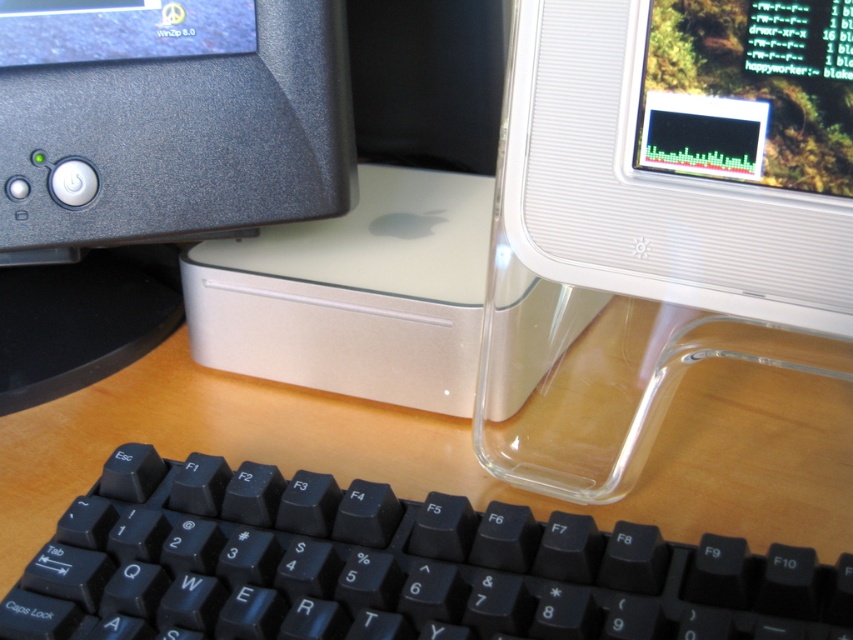
From the picture: You are setting up a new computer desk. You have a black plastic keyboard at lower center and a white Apple desktop computer tower behind it. You want to place a 12 inch long cable between them. Will the cable be long enough to reach?

The distance between the black plastic keyboard at lower center and the white Apple desktop computer tower is 12.28 inches. Since the cable is 12 inches long, it is slightly shorter than the required distance. The cable may not be long enough to comfortably reach between them.

You are setting up a new computer desk and need to ensure there is enough space between the black plastic keyboard at lower center and the transparent plastic screen at upper right. According to the image, what is the minimum distance you should leave between them?

The minimum distance you should leave between the black plastic keyboard at lower center and the transparent plastic screen at upper right is 24.78 centimeters, as that is the distance shown in the image.

You are setting up a new computer desk and want to ensure proper ergonomics. You have the black plastic keyboard at lower center and the white textured monitor at upper right. Which object should be placed closer to you to maintain good posture?

The black plastic keyboard at lower center should be placed closer to you since it is in front of the white textured monitor at upper right, allowing for comfortable typing while keeping the monitor at an optimal viewing distance.